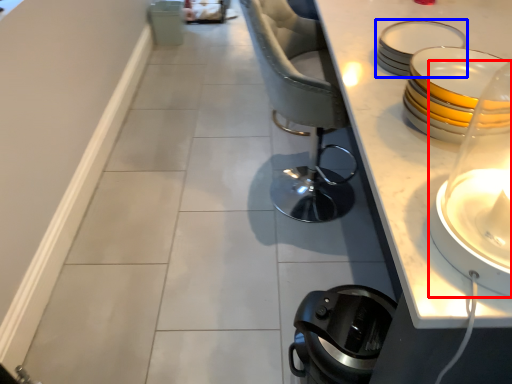
Question: Among these objects, which one is farthest to the camera, candle holder (highlighted by a red box) or tableware (highlighted by a blue box)?

Choices:
 (A) candle holder
 (B) tableware

Answer: (B)